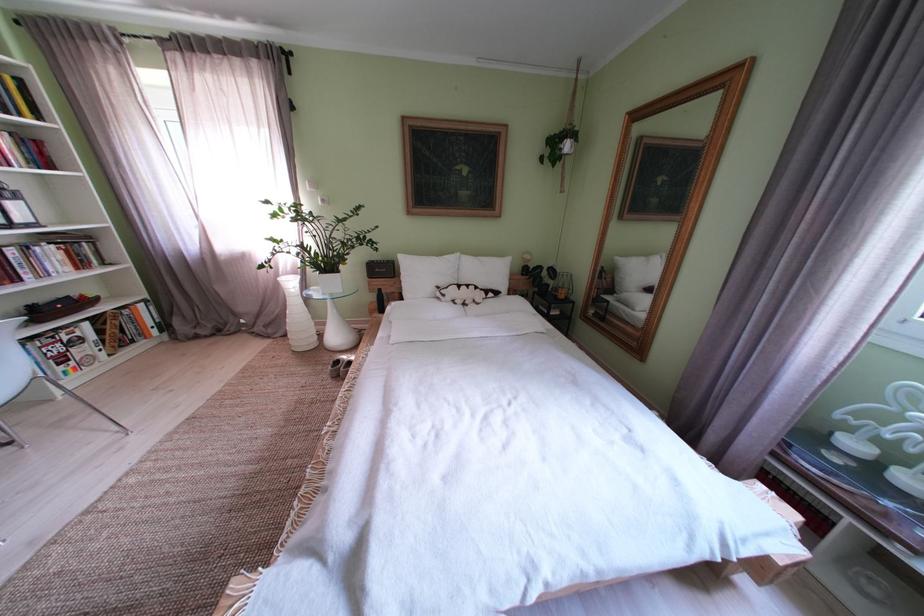
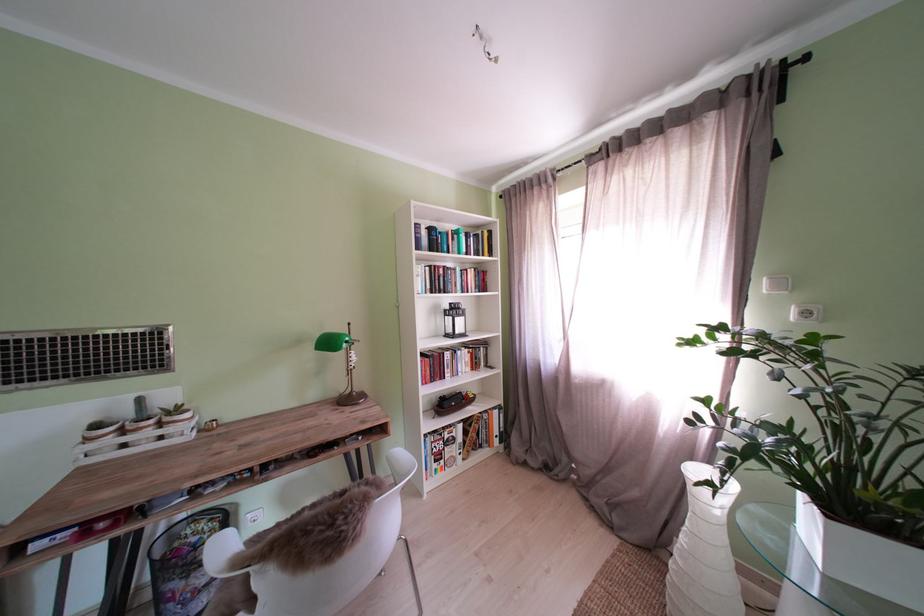
Find the pixel in the second image that matches point (237, 45) in the first image.

(681, 116)